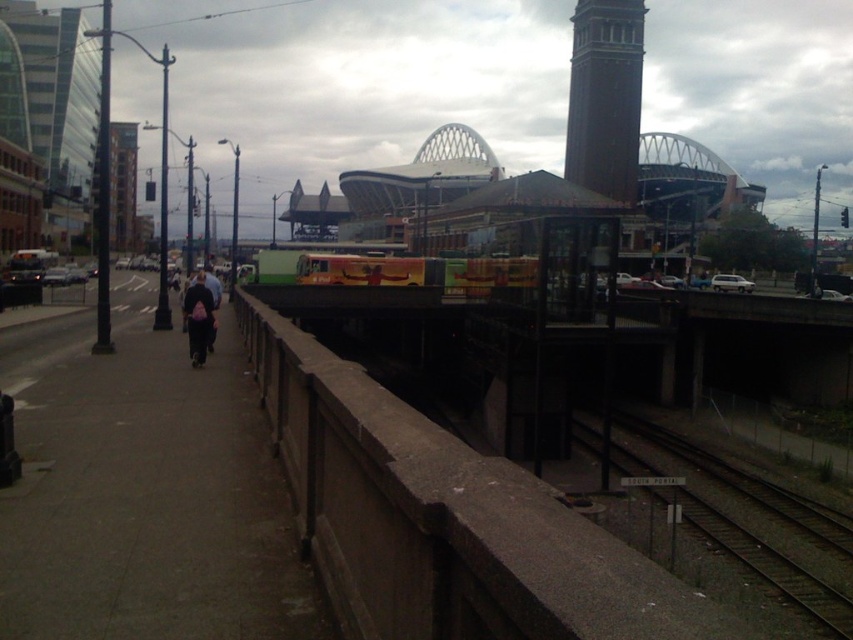
Is brown brick bell tower at upper center to the right of dark blue jeans at center from the viewer's perspective?

Indeed, brown brick bell tower at upper center is positioned on the right side of dark blue jeans at center.

The height and width of the screenshot is (640, 853). Describe the element at coordinates (605, 97) in the screenshot. I see `brown brick bell tower at upper center` at that location.

What are the coordinates of `brown brick bell tower at upper center` in the screenshot? It's located at click(605, 97).

Between dark gray metal train track at lower right and dark blue jeans at center, which one is positioned lower?

dark gray metal train track at lower right

Describe the element at coordinates (769, 566) in the screenshot. I see `dark gray metal train track at lower right` at that location.

Find the location of `dark gray metal train track at lower right`. dark gray metal train track at lower right is located at coordinates (769, 566).

Consider the image. Is brown brick bell tower at upper center taller than dark gray metal train track at lower right?

Yes.

Who is shorter, brown brick bell tower at upper center or dark gray metal train track at lower right?

dark gray metal train track at lower right is shorter.

Between point (628, 109) and point (730, 518), which one is positioned in front?

Point (730, 518)

The image size is (853, 640). What are the coordinates of `brown brick bell tower at upper center` in the screenshot? It's located at (605, 97).